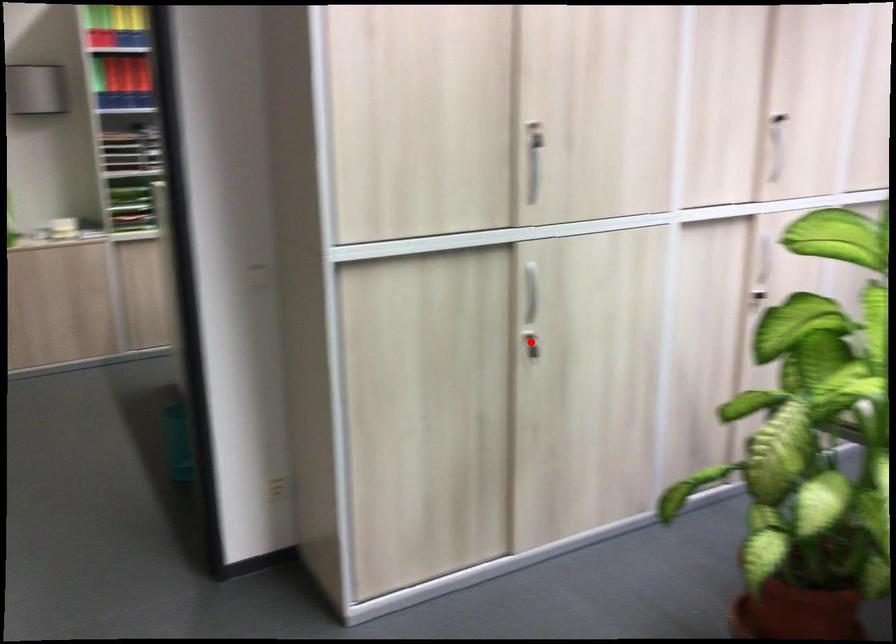
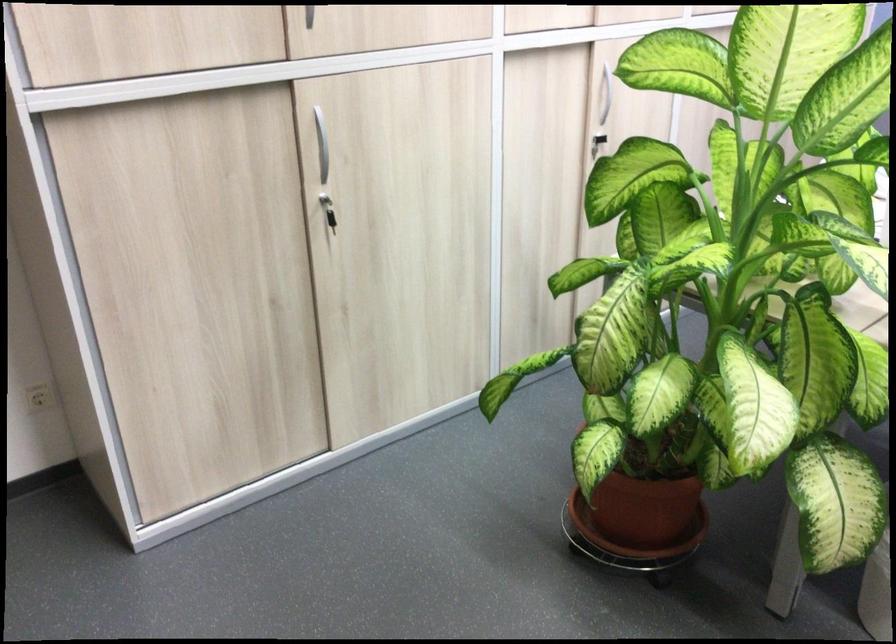
Locate, in the second image, the point that corresponds to the highlighted location in the first image.

(328, 210)